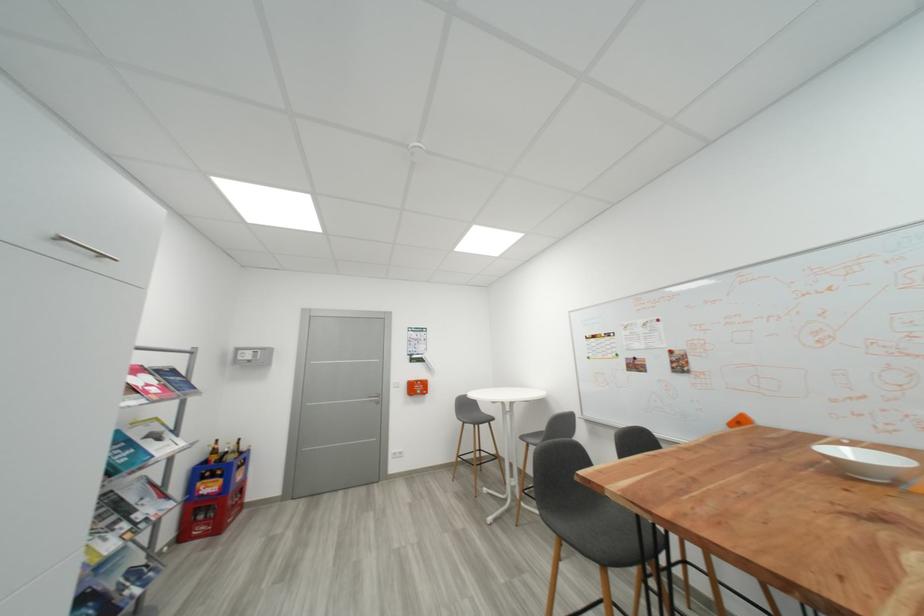
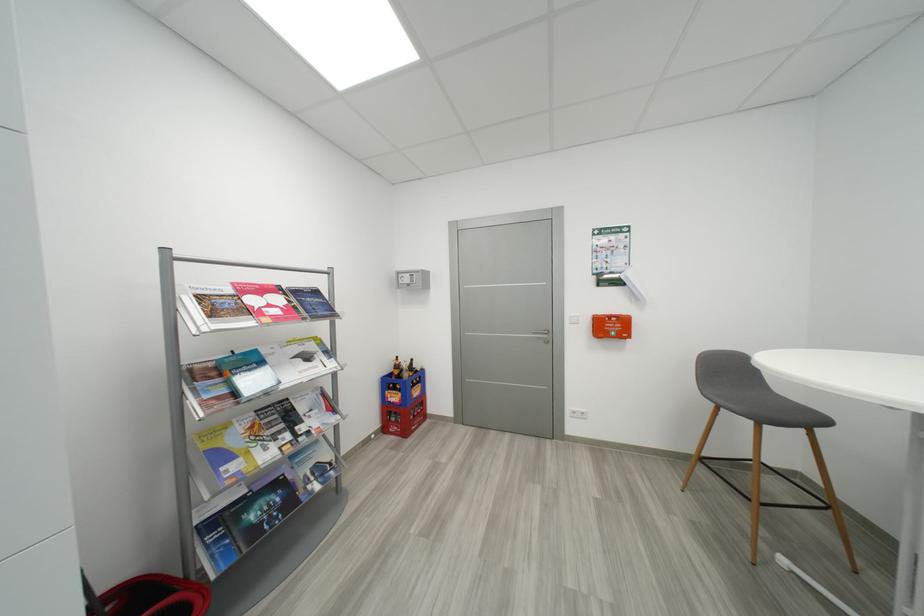
Where in the second image is the point corresponding to [254,358] from the first image?

(412, 282)